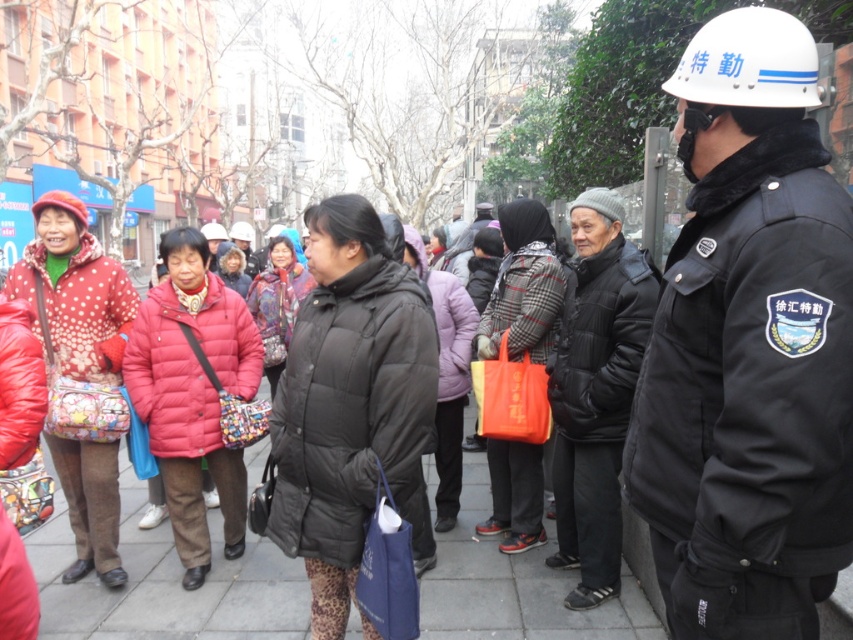
Who is taller, black puffy coat at center or smooth concrete pavement at center?

black puffy coat at center

The height and width of the screenshot is (640, 853). What are the coordinates of `black puffy coat at center` in the screenshot? It's located at pyautogui.click(x=349, y=401).

Can you confirm if plaid fabric jacket at center is wider than matte black jacket at center?

Yes.

Is plaid fabric jacket at center below matte black jacket at center?

No.

Is point (497, 508) positioned in front of point (444, 522)?

Yes, it is.

Where is `plaid fabric jacket at center`? The height and width of the screenshot is (640, 853). plaid fabric jacket at center is located at coordinates (523, 288).

Who is lower down, smooth concrete pavement at center or polka dot fabric bag at left?

Positioned lower is smooth concrete pavement at center.

What do you see at coordinates (167, 584) in the screenshot? This screenshot has width=853, height=640. I see `smooth concrete pavement at center` at bounding box center [167, 584].

Where is `smooth concrete pavement at center`? The image size is (853, 640). smooth concrete pavement at center is located at coordinates (167, 584).